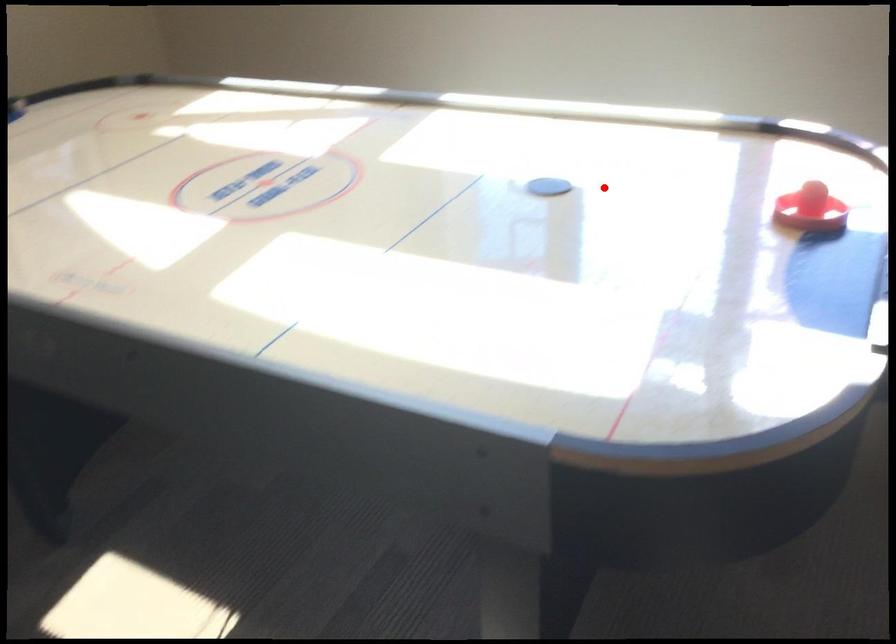
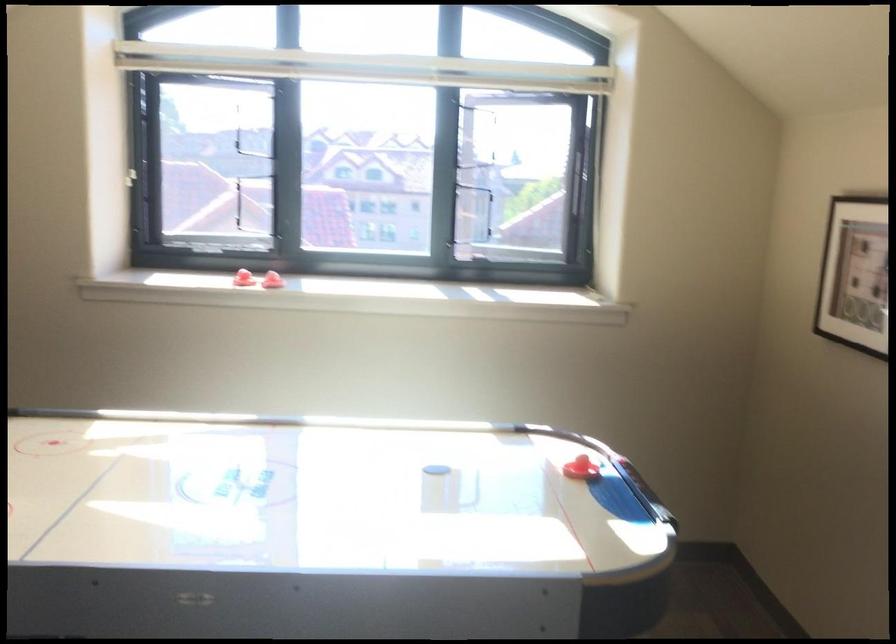
Question: I am providing you with two images of the same scene from different viewpoints. A red point is shown in image1. For the corresponding object point in image2, is it positioned nearer or farther from the camera?

Choices:
 (A) Nearer
 (B) Farther

Answer: (B)